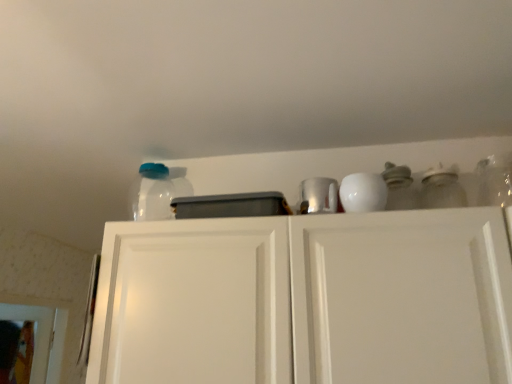
What is the approximate height of white matte cabinet doors at upper center?

white matte cabinet doors at upper center is 20.15 inches tall.

Where is `clear glass jar at upper right, the second glass jar in the back-to-front sequence`? The width and height of the screenshot is (512, 384). clear glass jar at upper right, the second glass jar in the back-to-front sequence is located at coordinates (442, 189).

In the scene shown: Could you tell me if shiny metallic cup at upper center is turned towards white matte cabinet doors at upper center?

No.

Is point (318, 191) closer to viewer compared to point (260, 336)?

No.

From the image's perspective, which one is positioned higher, shiny metallic cup at upper center or white matte cabinet doors at upper center?

shiny metallic cup at upper center, from the image's perspective.

Considering the sizes of objects shiny metallic cup at upper center and white matte cabinet doors at upper center in the image provided, who is wider, shiny metallic cup at upper center or white matte cabinet doors at upper center?

white matte cabinet doors at upper center.

Looking at this image, how many degrees apart are the facing directions of transparent plastic jar at upper left, the 1th glass jar positioned from the left, and clear glass jar at upper right, positioned as the 1th glass jar in right-to-left order?

There is a 8.66-degree angle between the facing directions of transparent plastic jar at upper left, the 1th glass jar positioned from the left, and clear glass jar at upper right, positioned as the 1th glass jar in right-to-left order.

Looking at their sizes, would you say transparent plastic jar at upper left, which is the second glass jar from front to back, is wider or thinner than clear glass jar at upper right, positioned as the 1th glass jar in right-to-left order?

In the image, transparent plastic jar at upper left, which is the second glass jar from front to back, appears to be wider than clear glass jar at upper right, positioned as the 1th glass jar in right-to-left order.

Which is closer, (158, 166) or (462, 199)?

Point (158, 166) is farther from the camera than point (462, 199).

Is transparent plastic jar at upper left, the 1th glass jar positioned from the left, further to camera compared to clear glass jar at upper right, the second glass jar in the back-to-front sequence?

That is True.

Is clear glass jar at upper right, positioned as the 1th glass jar in right-to-left order, not within shiny metallic cup at upper center?

A: clear glass jar at upper right, positioned as the 1th glass jar in right-to-left order, is positioned outside shiny metallic cup at upper center.

Between clear glass jar at upper right, positioned as the 1th glass jar in right-to-left order, and shiny metallic cup at upper center, which one has more height?

Standing taller between the two is clear glass jar at upper right, positioned as the 1th glass jar in right-to-left order.

Does point (424, 204) come closer to viewer compared to point (329, 206)?

No.

Is point (435, 195) positioned in front of point (166, 174)?

Yes, point (435, 195) is closer to viewer.

Can you tell me how much clear glass jar at upper right, which ranks as the second glass jar in left-to-right order, and transparent plastic jar at upper left, the 1th glass jar positioned from the left, differ in facing direction?

8.66 degrees.

Can we say clear glass jar at upper right, the second glass jar in the back-to-front sequence, lies outside transparent plastic jar at upper left, which appears as the 1th glass jar when viewed from the back?

Yes, clear glass jar at upper right, the second glass jar in the back-to-front sequence, is located beyond the bounds of transparent plastic jar at upper left, which appears as the 1th glass jar when viewed from the back.

Where is `glass jar above the transparent plastic jar at upper left, which is the second glass jar from front to back (from the image's perspective)`? glass jar above the transparent plastic jar at upper left, which is the second glass jar from front to back (from the image's perspective) is located at coordinates (442, 189).

From a real-world perspective, is shiny metallic cup at upper center located higher than clear glass jar at upper right, positioned as the 1th glass jar in right-to-left order?

Incorrect, from a real-world perspective, shiny metallic cup at upper center is lower than clear glass jar at upper right, positioned as the 1th glass jar in right-to-left order.

Are shiny metallic cup at upper center and clear glass jar at upper right, which ranks as the first glass jar in front-to-back order, making contact?

No, shiny metallic cup at upper center is not next to clear glass jar at upper right, which ranks as the first glass jar in front-to-back order.

How different are the orientations of shiny metallic cup at upper center and clear glass jar at upper right, positioned as the 1th glass jar in right-to-left order, in degrees?

shiny metallic cup at upper center and clear glass jar at upper right, positioned as the 1th glass jar in right-to-left order, are facing 9.9 degrees away from each other.

Find the location of a particular element. the 1st glass jar directly above the shiny metallic cup at upper center (from a real-world perspective) is located at coordinates (442, 189).

Do you think shiny metallic cup at upper center is within transparent plastic jar at upper left, the second glass jar viewed from the right, or outside of it?

The correct answer is: outside.

How different are the orientations of shiny metallic cup at upper center and transparent plastic jar at upper left, which is the second glass jar from front to back, in degrees?

The angle between the facing direction of shiny metallic cup at upper center and the facing direction of transparent plastic jar at upper left, which is the second glass jar from front to back, is 1.24 degrees.

Which object is wider, shiny metallic cup at upper center or transparent plastic jar at upper left, the second glass jar viewed from the right?

shiny metallic cup at upper center.

Is shiny metallic cup at upper center to the left of transparent plastic jar at upper left, which is the second glass jar from front to back, from the viewer's perspective?

No, shiny metallic cup at upper center is not to the left of transparent plastic jar at upper left, which is the second glass jar from front to back.

Considering the relative sizes of white matte cabinet doors at upper center and transparent plastic jar at upper left, which appears as the 1th glass jar when viewed from the back, in the image provided, is white matte cabinet doors at upper center taller than transparent plastic jar at upper left, which appears as the 1th glass jar when viewed from the back,?

Yes.

Is white matte cabinet doors at upper center wider than transparent plastic jar at upper left, the second glass jar viewed from the right?

Yes.

Does point (483, 274) lie behind point (169, 186)?

No, (483, 274) is in front of (169, 186).

Is transparent plastic jar at upper left, which is the second glass jar from front to back, surrounded by white matte cabinet doors at upper center?

No, transparent plastic jar at upper left, which is the second glass jar from front to back, is not surrounded by white matte cabinet doors at upper center.

Find the location of `appliance on the right of white matte cabinet doors at upper center`. appliance on the right of white matte cabinet doors at upper center is located at coordinates pyautogui.click(x=319, y=195).

Locate an element on the screen. Image resolution: width=512 pixels, height=384 pixels. glass jar located in front of the transparent plastic jar at upper left, which is the second glass jar from front to back is located at coordinates (442, 189).

Based on their spatial positions, is transparent plastic jar at upper left, which appears as the 1th glass jar when viewed from the back, or shiny metallic cup at upper center closer to clear glass jar at upper right, the second glass jar in the back-to-front sequence?

The object closer to clear glass jar at upper right, the second glass jar in the back-to-front sequence, is shiny metallic cup at upper center.

Estimate the real-world distances between objects in this image. Which object is further from white matte cabinet doors at upper center, shiny metallic cup at upper center or transparent plastic jar at upper left, which appears as the 1th glass jar when viewed from the back?

Among the two, transparent plastic jar at upper left, which appears as the 1th glass jar when viewed from the back, is located further to white matte cabinet doors at upper center.

Looking at the image, which one is located further to white matte cabinet doors at upper center, shiny metallic cup at upper center or clear glass jar at upper right, positioned as the 1th glass jar in right-to-left order?

clear glass jar at upper right, positioned as the 1th glass jar in right-to-left order, lies further to white matte cabinet doors at upper center than the other object.

Looking at this image, from the image, which object appears to be nearer to clear glass jar at upper right, which ranks as the second glass jar in left-to-right order, transparent plastic jar at upper left, which appears as the 1th glass jar when viewed from the back, or white matte cabinet doors at upper center?

white matte cabinet doors at upper center.

Looking at the image, which one is located closer to shiny metallic cup at upper center, transparent plastic jar at upper left, which appears as the 1th glass jar when viewed from the back, or clear glass jar at upper right, which ranks as the first glass jar in front-to-back order?

The object closer to shiny metallic cup at upper center is clear glass jar at upper right, which ranks as the first glass jar in front-to-back order.

Which object lies nearer to the anchor point shiny metallic cup at upper center, white matte cabinet doors at upper center or transparent plastic jar at upper left, the 1th glass jar positioned from the left?

white matte cabinet doors at upper center is positioned closer to the anchor shiny metallic cup at upper center.

From the picture: Which object lies nearer to the anchor point clear glass jar at upper right, which ranks as the second glass jar in left-to-right order, shiny metallic cup at upper center or white matte cabinet doors at upper center?

shiny metallic cup at upper center lies closer to clear glass jar at upper right, which ranks as the second glass jar in left-to-right order, than the other object.

Considering their positions, is clear glass jar at upper right, positioned as the 1th glass jar in right-to-left order, positioned further to white matte cabinet doors at upper center than transparent plastic jar at upper left, which appears as the 1th glass jar when viewed from the back?

clear glass jar at upper right, positioned as the 1th glass jar in right-to-left order, is positioned further to the anchor white matte cabinet doors at upper center.

Find the location of a particular element. The width and height of the screenshot is (512, 384). appliance between white matte cabinet doors at upper center and clear glass jar at upper right, which ranks as the first glass jar in front-to-back order is located at coordinates (319, 195).

Where is `cabinetry situated between transparent plastic jar at upper left, which is the second glass jar from front to back, and clear glass jar at upper right, which ranks as the first glass jar in front-to-back order, from left to right`? This screenshot has width=512, height=384. cabinetry situated between transparent plastic jar at upper left, which is the second glass jar from front to back, and clear glass jar at upper right, which ranks as the first glass jar in front-to-back order, from left to right is located at coordinates (306, 300).

Identify the location of appliance between transparent plastic jar at upper left, the second glass jar viewed from the right, and clear glass jar at upper right, which ranks as the first glass jar in front-to-back order, in the horizontal direction. This screenshot has height=384, width=512. (319, 195).

Identify the location of cabinetry between transparent plastic jar at upper left, the second glass jar viewed from the right, and shiny metallic cup at upper center from left to right. (306, 300).